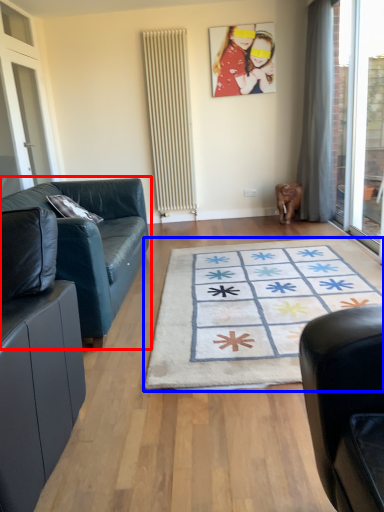
Question: Which object appears farthest to the camera in this image, studio couch (highlighted by a red box) or mat (highlighted by a blue box)?

Choices:
 (A) studio couch
 (B) mat

Answer: (A)